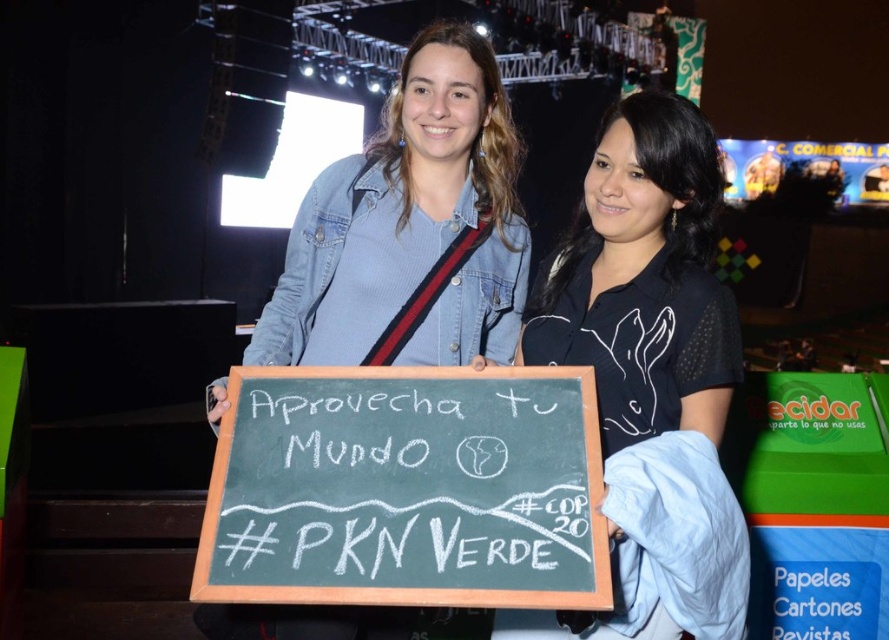
What are the coordinates of the black chalkboard at center?

The black chalkboard at center is located at coordinates point (406, 490).

You are a photographer at the event and need to capture a clear photo of the black matte shirt at center. The camera you are using has a minimum focusing distance of 1.5 meters. Will you be able to take a clear photo without moving closer?

The black matte shirt at center and camera are 1.42 meters apart from each other. Since the minimum focusing distance is 1.5 meters, the camera cannot focus clearly at 1.42 meters. You need to move back to ensure the distance is at least 1.5 meters for a clear photo.

You are an event organizer who needs to ensure that the black matte shirt at center and the denim jacket at center are visible to the audience. Given their heights, which one might require a higher podium to be seen clearly?

The black matte shirt at center has a greater height compared to the denim jacket at center, so the denim jacket at center would need a higher podium to ensure visibility since it is shorter.